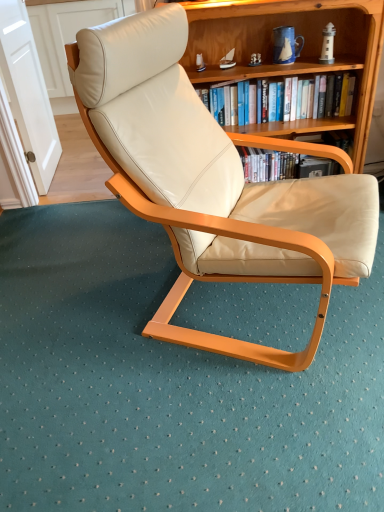
In the scene shown: What is the approximate width of wooden bookshelf at upper center?

It is 35.65 centimeters.

Describe the element at coordinates (303, 49) in the screenshot. The height and width of the screenshot is (512, 384). I see `wooden bookshelf at upper center` at that location.

Where is `hardcover book at upper center`? hardcover book at upper center is located at coordinates (315, 98).

Locate an element on the screen. matte cream leather chair at center is located at coordinates (214, 182).

Is hardcover book at upper center at the back of matte cream leather chair at center?

No.

Is the position of matte cream leather chair at center less distant than that of hardcover book at upper center?

Yes, the depth of matte cream leather chair at center is less than that of hardcover book at upper center.

How many degrees apart are the facing directions of matte cream leather chair at center and hardcover book at upper center?

They differ by 65 degrees in their facing directions.

From a real-world perspective, is matte cream leather chair at center physically located above or below hardcover book at upper center?

matte cream leather chair at center is situated lower than hardcover book at upper center in the real world.

Who is shorter, hardcover book at upper center or matte cream leather chair at center?

hardcover book at upper center is shorter.

Looking at this image, does hardcover book at upper center appear on the left side of matte cream leather chair at center?

In fact, hardcover book at upper center is to the right of matte cream leather chair at center.

Can you see hardcover book at upper center touching matte cream leather chair at center?

No, hardcover book at upper center is not making contact with matte cream leather chair at center.

From a real-world perspective, is hardcover book at upper center physically above matte cream leather chair at center?

Yes.

Would you consider wooden bookshelf at upper center to be distant from matte cream leather chair at center?

No, wooden bookshelf at upper center is not far away from matte cream leather chair at center.

Considering the relative sizes of wooden bookshelf at upper center and matte cream leather chair at center in the image provided, is wooden bookshelf at upper center shorter than matte cream leather chair at center?

Correct, wooden bookshelf at upper center is not as tall as matte cream leather chair at center.

From a real-world perspective, who is located higher, wooden bookshelf at upper center or matte cream leather chair at center?

From a 3D spatial view, matte cream leather chair at center is above.

In the scene shown: Is wooden bookshelf at upper center in front of or behind matte cream leather chair at center in the image?

wooden bookshelf at upper center is positioned farther from the viewer than matte cream leather chair at center.

Considering the positions of point (209, 3) and point (310, 94), is point (209, 3) closer or farther from the camera than point (310, 94)?

Point (209, 3) is positioned closer to the camera compared to point (310, 94).

Where is `bookcase below the hardcover book at upper center (from the image's perspective)`? The width and height of the screenshot is (384, 512). bookcase below the hardcover book at upper center (from the image's perspective) is located at coordinates coord(303,49).

Consider the image. From a real-world perspective, relative to hardcover book at upper center, is wooden bookshelf at upper center vertically above or below?

Clearly, from a real-world perspective, wooden bookshelf at upper center is below hardcover book at upper center.

From the image's perspective, between wooden bookshelf at upper center and hardcover book at upper center, which one is located above?

hardcover book at upper center.

Is matte cream leather chair at center turned away from wooden bookshelf at upper center?

No, matte cream leather chair at center's orientation is not away from wooden bookshelf at upper center.

Based on the photo, is matte cream leather chair at center far from wooden bookshelf at upper center?

No, there isn't a large distance between matte cream leather chair at center and wooden bookshelf at upper center.

In the scene shown: Considering the relative positions of matte cream leather chair at center and wooden bookshelf at upper center in the image provided, is matte cream leather chair at center to the right of wooden bookshelf at upper center from the viewer's perspective?

Incorrect, matte cream leather chair at center is not on the right side of wooden bookshelf at upper center.

From the image's perspective, is matte cream leather chair at center on top of wooden bookshelf at upper center?

Actually, matte cream leather chair at center appears below wooden bookshelf at upper center in the image.

Is hardcover book at upper center positioned beyond the bounds of wooden bookshelf at upper center?

No, hardcover book at upper center is not outside of wooden bookshelf at upper center.

Is hardcover book at upper center aimed at wooden bookshelf at upper center?

Yes, hardcover book at upper center is aimed at wooden bookshelf at upper center.

Looking at their sizes, would you say hardcover book at upper center is wider or thinner than wooden bookshelf at upper center?

Clearly, hardcover book at upper center has less width compared to wooden bookshelf at upper center.

Identify the location of chair that is under the hardcover book at upper center (from a real-world perspective). The height and width of the screenshot is (512, 384). point(214,182).

The height and width of the screenshot is (512, 384). Identify the location of chair below the hardcover book at upper center (from the image's perspective). (214, 182).

Which object lies further to the anchor point matte cream leather chair at center, wooden bookshelf at upper center or hardcover book at upper center?

hardcover book at upper center lies further to matte cream leather chair at center than the other object.

Considering their positions, is hardcover book at upper center positioned further to matte cream leather chair at center than wooden bookshelf at upper center?

hardcover book at upper center is further to matte cream leather chair at center.

Consider the image. Based on their spatial positions, is wooden bookshelf at upper center or matte cream leather chair at center further from hardcover book at upper center?

The object further to hardcover book at upper center is matte cream leather chair at center.

Considering their positions, is matte cream leather chair at center positioned closer to wooden bookshelf at upper center than hardcover book at upper center?

hardcover book at upper center lies closer to wooden bookshelf at upper center than the other object.

Which object lies further to the anchor point wooden bookshelf at upper center, hardcover book at upper center or matte cream leather chair at center?

matte cream leather chair at center is further to wooden bookshelf at upper center.

Looking at the image, which one is located closer to hardcover book at upper center, matte cream leather chair at center or wooden bookshelf at upper center?

Among the two, wooden bookshelf at upper center is located nearer to hardcover book at upper center.

You are a GUI agent. You are given a task and a screenshot of the screen. Output one action in this format:
    pyautogui.click(x=<x>, y=<y>)
    Task: Click on the bookcase located between matte cream leather chair at center and hardcover book at upper center in the depth direction
    The width and height of the screenshot is (384, 512).
    Given the screenshot: What is the action you would take?
    pyautogui.click(x=303, y=49)